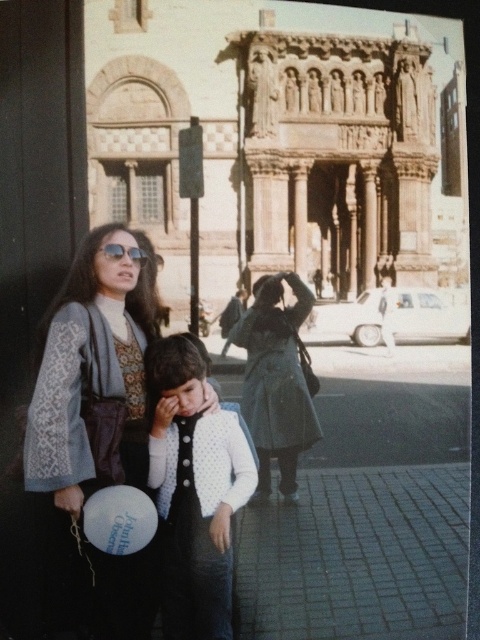
Which is below, white dotted cardigan at center or dark gray wool coat at center?

white dotted cardigan at center

Is white dotted cardigan at center bigger than dark gray wool coat at center?

Actually, white dotted cardigan at center might be smaller than dark gray wool coat at center.

Locate an element on the screen. white dotted cardigan at center is located at coordinates (193, 492).

Does white dotted cardigan at center have a greater width compared to matte black sunglasses at upper left?

Yes.

What do you see at coordinates (193, 492) in the screenshot? I see `white dotted cardigan at center` at bounding box center [193, 492].

At what (x,y) coordinates should I click in order to perform the action: click on white dotted cardigan at center. Please return your answer as a coordinate pair (x, y). The width and height of the screenshot is (480, 640). Looking at the image, I should click on pos(193,492).

Does matte gray sweater at left come behind white dotted cardigan at center?

No, matte gray sweater at left is in front of white dotted cardigan at center.

Who is more forward, (108, 326) or (202, 440)?

Point (202, 440) is more forward.

Where is `matte gray sweater at left`? matte gray sweater at left is located at coordinates (93, 435).